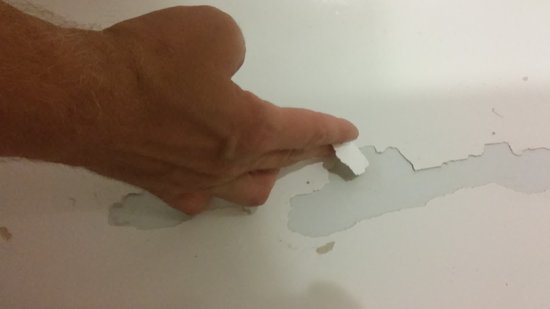
Locate an element on the screen. The width and height of the screenshot is (550, 309). light is located at coordinates (437, 225).